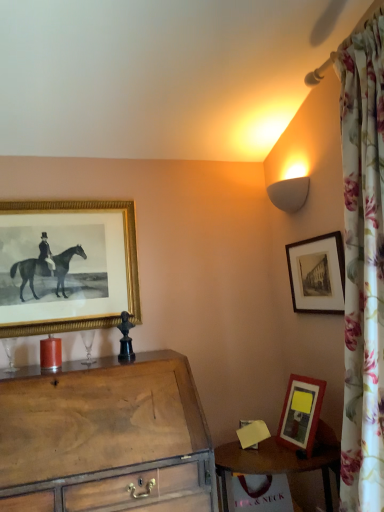
What is the approximate width of wooden chest of drawers at lower left?

The width of wooden chest of drawers at lower left is 25.57 inches.

This screenshot has width=384, height=512. What do you see at coordinates (50, 354) in the screenshot? I see `matte glass candle at left` at bounding box center [50, 354].

Image resolution: width=384 pixels, height=512 pixels. What are the coordinates of `wooden table at lower right` in the screenshot? It's located at (282, 461).

What do you see at coordinates (317, 274) in the screenshot?
I see `black matte picture frame at upper right, the 1th picture frame positioned from the right` at bounding box center [317, 274].

The height and width of the screenshot is (512, 384). Find the location of `gold textured picture frame at upper left, which ranks as the 1th picture frame in left-to-right order`. gold textured picture frame at upper left, which ranks as the 1th picture frame in left-to-right order is located at coordinates (67, 266).

From the image's perspective, which object appears higher, black matte picture frame at upper right, the 1th picture frame positioned from the right, or matte glass candle at left?

black matte picture frame at upper right, the 1th picture frame positioned from the right, is shown above in the image.

Is the position of black matte picture frame at upper right, which is the second picture frame in left-to-right order, less distant than that of matte glass candle at left?

Yes, black matte picture frame at upper right, which is the second picture frame in left-to-right order, is closer to the camera.

In the scene shown: Is black matte picture frame at upper right, the 1th picture frame positioned from the right, located outside matte glass candle at left?

Indeed, black matte picture frame at upper right, the 1th picture frame positioned from the right, is completely outside matte glass candle at left.

From the image's perspective, does wooden chest of drawers at lower left appear higher than black matte picture frame at upper right, which is the second picture frame in left-to-right order?

No, from the image's perspective, wooden chest of drawers at lower left is not over black matte picture frame at upper right, which is the second picture frame in left-to-right order.

Is wooden chest of drawers at lower left completely or partially outside of black matte picture frame at upper right, the 1th picture frame positioned from the right?

Yes, wooden chest of drawers at lower left is located beyond the bounds of black matte picture frame at upper right, the 1th picture frame positioned from the right.

Between wooden chest of drawers at lower left and black matte picture frame at upper right, the 1th picture frame positioned from the right, which one has larger width?

Wider between the two is wooden chest of drawers at lower left.

Which is in front, wooden chest of drawers at lower left or matte glass candle at left?

wooden chest of drawers at lower left is in front.

Can you confirm if wooden chest of drawers at lower left is taller than matte glass candle at left?

Yes.

From the image's perspective, is wooden chest of drawers at lower left above matte glass candle at left?

Incorrect, from the image's perspective, wooden chest of drawers at lower left is lower than matte glass candle at left.

Is wooden table at lower right oriented away from matte glass candle at left?

No, wooden table at lower right is not facing the opposite direction of matte glass candle at left.

How different are the orientations of wooden table at lower right and matte glass candle at left in degrees?

The angular difference between wooden table at lower right and matte glass candle at left is 12.4 degrees.

Between wooden table at lower right and matte glass candle at left, which one is positioned behind?

matte glass candle at left is further from the camera.

Who is bigger, wooden chest of drawers at lower left or gold textured picture frame at upper left, the 2th picture frame viewed from the right?

With larger size is wooden chest of drawers at lower left.

Is wooden chest of drawers at lower left closer to camera compared to gold textured picture frame at upper left, the 2th picture frame viewed from the right?

That is True.

Who is taller, wooden chest of drawers at lower left or gold textured picture frame at upper left, which ranks as the 1th picture frame in left-to-right order?

With more height is wooden chest of drawers at lower left.

From the image's perspective, is wooden chest of drawers at lower left above or below gold textured picture frame at upper left, the 2th picture frame viewed from the right?

wooden chest of drawers at lower left is situated lower than gold textured picture frame at upper left, the 2th picture frame viewed from the right, in the image.

Is matte glass candle at left facing towards gold textured picture frame at upper left, the 2th picture frame viewed from the right?

No, matte glass candle at left does not turn towards gold textured picture frame at upper left, the 2th picture frame viewed from the right.

Who is more distant, matte glass candle at left or gold textured picture frame at upper left, the 2th picture frame viewed from the right?

gold textured picture frame at upper left, the 2th picture frame viewed from the right, is further from the camera.

Is matte glass candle at left beside gold textured picture frame at upper left, which ranks as the 1th picture frame in left-to-right order?

No, matte glass candle at left is not with gold textured picture frame at upper left, which ranks as the 1th picture frame in left-to-right order.

Does point (58, 353) appear closer or farther from the camera than point (107, 297)?

Point (58, 353) is closer to the camera than point (107, 297).

Is wooden table at lower right directly adjacent to wooden chest of drawers at lower left?

wooden table at lower right is not next to wooden chest of drawers at lower left, and they're not touching.

Is wooden table at lower right looking in the opposite direction of wooden chest of drawers at lower left?

No, wooden table at lower right's orientation is not away from wooden chest of drawers at lower left.

Considering the relative sizes of wooden table at lower right and wooden chest of drawers at lower left in the image provided, is wooden table at lower right thinner than wooden chest of drawers at lower left?

Correct, the width of wooden table at lower right is less than that of wooden chest of drawers at lower left.

Does wooden table at lower right have a larger size compared to wooden chest of drawers at lower left?

No, wooden table at lower right is not bigger than wooden chest of drawers at lower left.

The width and height of the screenshot is (384, 512). There is a matte glass candle at left. Identify the location of the 1st picture frame above it (from a real-world perspective). (317, 274).

Where is `the 1st picture frame behind the wooden chest of drawers at lower left, starting your count from the anchor`? Image resolution: width=384 pixels, height=512 pixels. the 1st picture frame behind the wooden chest of drawers at lower left, starting your count from the anchor is located at coordinates (317, 274).

Based on their spatial positions, is black matte picture frame at upper right, the 1th picture frame positioned from the right, or wooden chest of drawers at lower left further from matte glass candle at left?

black matte picture frame at upper right, the 1th picture frame positioned from the right, is further to matte glass candle at left.

Looking at the image, which one is located further to black matte picture frame at upper right, which is the second picture frame in left-to-right order, wooden table at lower right or gold textured picture frame at upper left, the 2th picture frame viewed from the right?

gold textured picture frame at upper left, the 2th picture frame viewed from the right, lies further to black matte picture frame at upper right, which is the second picture frame in left-to-right order, than the other object.

Considering their positions, is gold textured picture frame at upper left, which ranks as the 1th picture frame in left-to-right order, positioned further to matte glass candle at left than wooden table at lower right?

Among the two, wooden table at lower right is located further to matte glass candle at left.

Which object lies further to the anchor point wooden table at lower right, gold textured picture frame at upper left, the 2th picture frame viewed from the right, or black matte picture frame at upper right, which is the second picture frame in left-to-right order?

Based on the image, gold textured picture frame at upper left, the 2th picture frame viewed from the right, appears to be further to wooden table at lower right.

From the image, which object appears to be nearer to wooden chest of drawers at lower left, wooden table at lower right or black matte picture frame at upper right, the 1th picture frame positioned from the right?

wooden table at lower right lies closer to wooden chest of drawers at lower left than the other object.

Considering their positions, is wooden table at lower right positioned further to black matte picture frame at upper right, the 1th picture frame positioned from the right, than wooden chest of drawers at lower left?

Among the two, wooden chest of drawers at lower left is located further to black matte picture frame at upper right, the 1th picture frame positioned from the right.

Looking at the image, which one is located closer to black matte picture frame at upper right, which is the second picture frame in left-to-right order, gold textured picture frame at upper left, which ranks as the 1th picture frame in left-to-right order, or matte glass candle at left?

gold textured picture frame at upper left, which ranks as the 1th picture frame in left-to-right order.

Estimate the real-world distances between objects in this image. Which object is further from black matte picture frame at upper right, which is the second picture frame in left-to-right order, wooden chest of drawers at lower left or wooden table at lower right?

The object further to black matte picture frame at upper right, which is the second picture frame in left-to-right order, is wooden chest of drawers at lower left.

Locate an element on the screen. This screenshot has height=512, width=384. picture frame between matte glass candle at left and wooden table at lower right is located at coordinates (67, 266).

The height and width of the screenshot is (512, 384). I want to click on table located between wooden chest of drawers at lower left and black matte picture frame at upper right, which is the second picture frame in left-to-right order, in the left-right direction, so click(x=282, y=461).

At what (x,y) coordinates should I click in order to perform the action: click on picture frame between matte glass candle at left and black matte picture frame at upper right, the 1th picture frame positioned from the right, from left to right. Please return your answer as a coordinate pair (x, y). The height and width of the screenshot is (512, 384). Looking at the image, I should click on (67, 266).

Where is `the chest of drawers situated between matte glass candle at left and wooden table at lower right from left to right`? The image size is (384, 512). the chest of drawers situated between matte glass candle at left and wooden table at lower right from left to right is located at coordinates (106, 438).